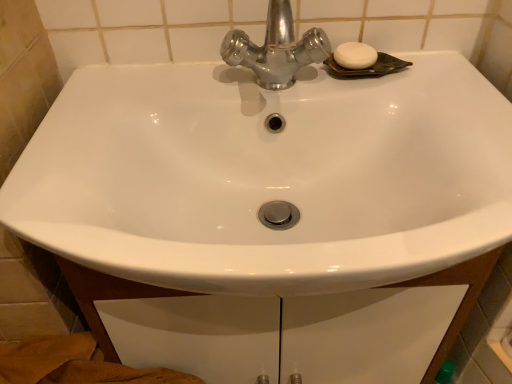
What are the coordinates of `unoccupied region to the right of shiny metallic faucet at upper center` in the screenshot? It's located at (420, 98).